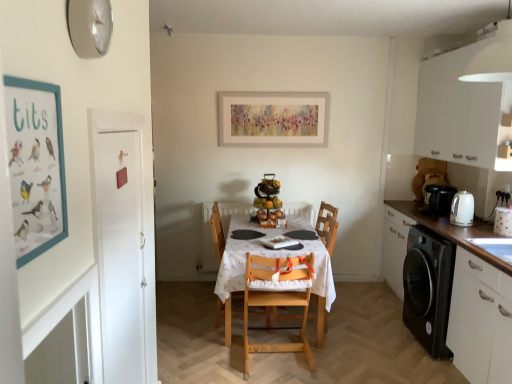
This screenshot has width=512, height=384. I want to click on free space to the left of white wood table at center, so click(x=185, y=311).